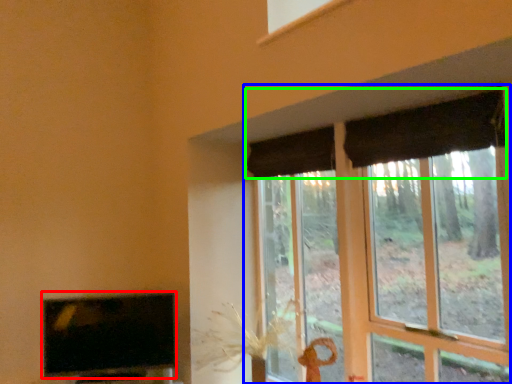
Question: Considering the real-world distances, which object is closest to television (highlighted by a red box)? window (highlighted by a blue box) or curtain (highlighted by a green box).

Choices:
 (A) window
 (B) curtain

Answer: (B)